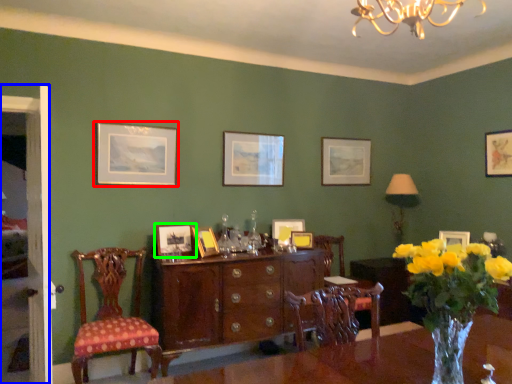
Question: Based on their relative distances, which object is nearer to picture frame (highlighted by a red box)? Choose from side (highlighted by a blue box) and picture frame (highlighted by a green box).

Choices:
 (A) side
 (B) picture frame

Answer: (B)